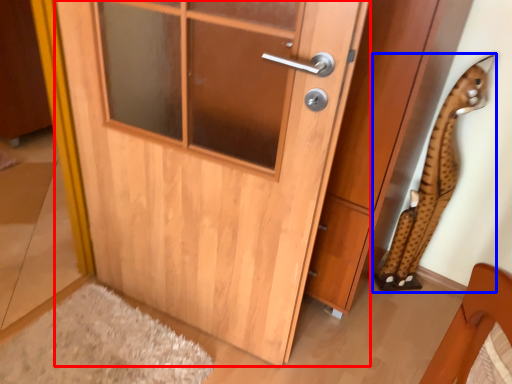
Question: Which of the following is the farthest to the observer, door (highlighted by a red box) or animal (highlighted by a blue box)?

Choices:
 (A) door
 (B) animal

Answer: (B)